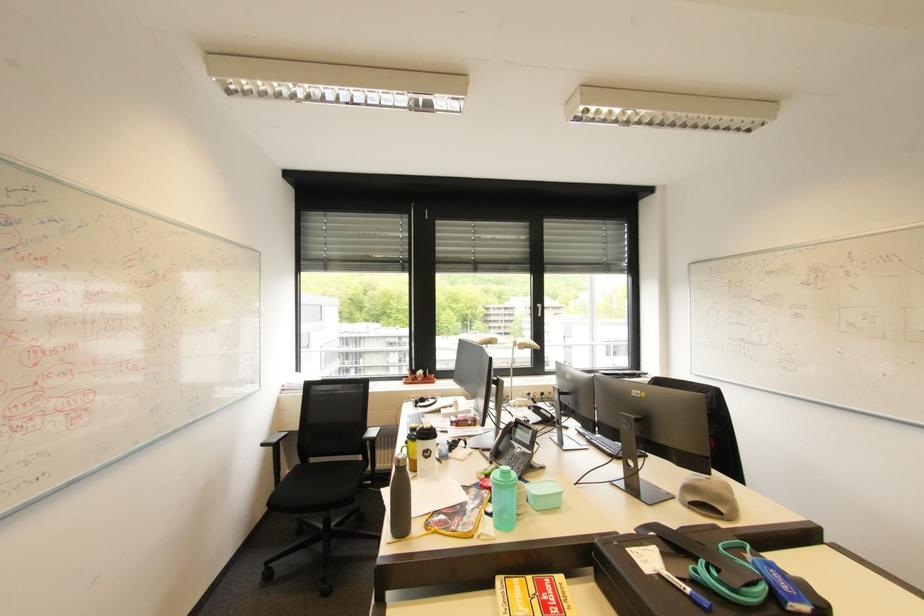
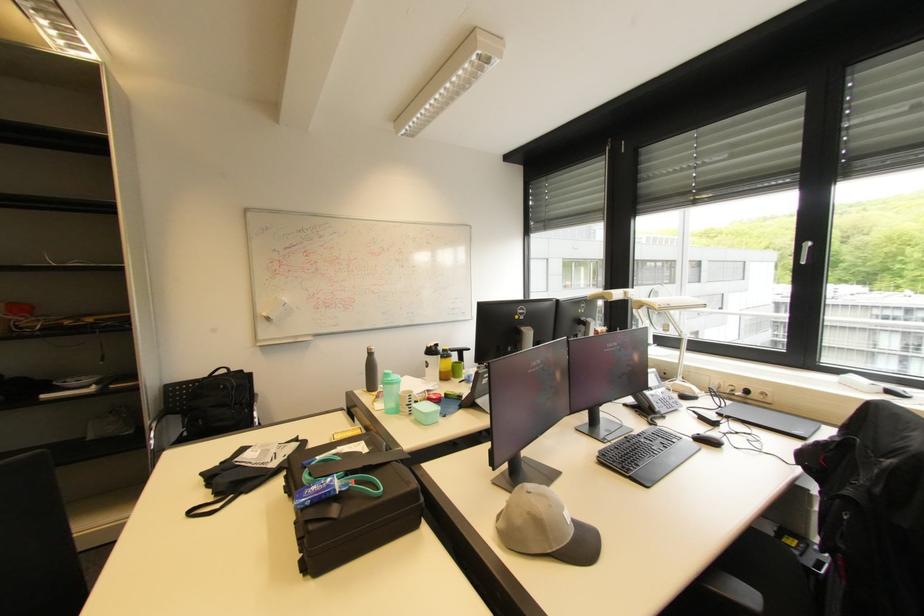
The point at (517, 477) is marked in the first image. Where is the corresponding point in the second image?

(394, 379)